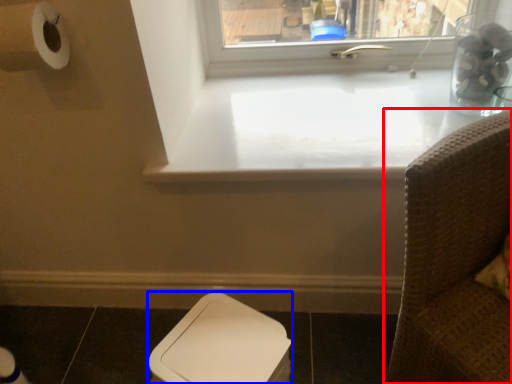
Question: Which object appears farthest to the camera in this image, furniture (highlighted by a red box) or toilet bowl (highlighted by a blue box)?

Choices:
 (A) furniture
 (B) toilet bowl

Answer: (B)